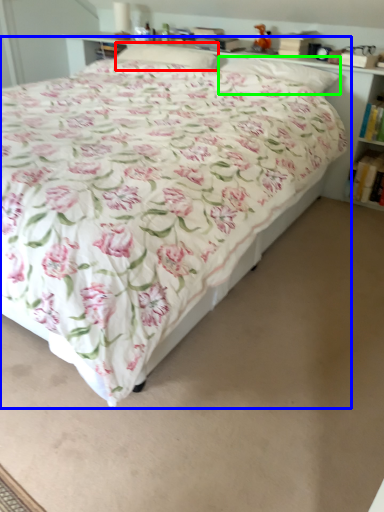
Question: Estimate the real-world distances between objects in this image. Which object is closer to pillow (highlighted by a red box), bed (highlighted by a blue box) or pillow (highlighted by a green box)?

Choices:
 (A) bed
 (B) pillow

Answer: (B)